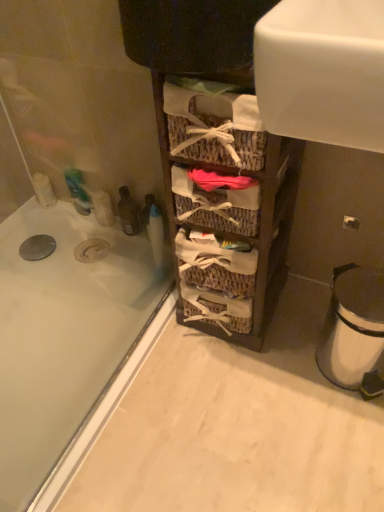
What do you see at coordinates (353, 327) in the screenshot? I see `white metallic trash can at lower right` at bounding box center [353, 327].

Measure the distance between point (359, 369) and camera.

Point (359, 369) is 1.07 meters from camera.

I want to click on white metallic trash can at lower right, so [x=353, y=327].

From the image's perspective, between white glossy bathtub at lower left and white metallic trash can at lower right, which one is located above?

white glossy bathtub at lower left appears higher in the image.

Is white glossy bathtub at lower left wider or thinner than white metallic trash can at lower right?

Considering their sizes, white glossy bathtub at lower left looks broader than white metallic trash can at lower right.

Considering the relative sizes of white glossy bathtub at lower left and white metallic trash can at lower right in the image provided, is white glossy bathtub at lower left shorter than white metallic trash can at lower right?

Yes.

Would you say white glossy bathtub at lower left contains white metallic trash can at lower right?

Definitely not — white metallic trash can at lower right is not inside white glossy bathtub at lower left.

Does white metallic trash can at lower right contain white glossy bathtub at lower left?

No, white metallic trash can at lower right does not contain white glossy bathtub at lower left.

Considering the sizes of objects white metallic trash can at lower right and white glossy bathtub at lower left in the image provided, who is wider, white metallic trash can at lower right or white glossy bathtub at lower left?

Result: With larger width is white glossy bathtub at lower left.

From a real-world perspective, which is physically above, white metallic trash can at lower right or white glossy bathtub at lower left?

From a 3D spatial view, white metallic trash can at lower right is above.

Is white metallic trash can at lower right aimed at white glossy bathtub at lower left?

No.

Considering the sizes of objects woven wood baskets at center and white metallic trash can at lower right in the image provided, who is bigger, woven wood baskets at center or white metallic trash can at lower right?

woven wood baskets at center.

Which object is closer to the camera, woven wood baskets at center or white metallic trash can at lower right?

woven wood baskets at center is more forward.

This screenshot has width=384, height=512. In order to click on trash bin/can below the woven wood baskets at center (from the image's perspective) in this screenshot , I will do [353, 327].

From a real-world perspective, is woven wood baskets at center positioned over white metallic trash can at lower right based on gravity?

Indeed, from a real-world perspective, woven wood baskets at center stands above white metallic trash can at lower right.

Which object is positioned more to the left, white metallic trash can at lower right or woven wood baskets at center?

woven wood baskets at center is more to the left.

Which is in front, white metallic trash can at lower right or woven wood baskets at center?

woven wood baskets at center is in front.

Identify the location of trash bin/can below the woven wood baskets at center (from a real-world perspective). (353, 327).

Could you tell me if white metallic trash can at lower right is facing woven wood baskets at center?

No, white metallic trash can at lower right is not oriented towards woven wood baskets at center.

From the image's perspective, who appears lower, white glossy bathtub at lower left or woven wood baskets at center?

white glossy bathtub at lower left, from the image's perspective.

How different are the orientations of white glossy bathtub at lower left and woven wood baskets at center in degrees?

There is a 89.6-degree angle between the facing directions of white glossy bathtub at lower left and woven wood baskets at center.

Consider the image. Can you confirm if white glossy bathtub at lower left is taller than woven wood baskets at center?

Incorrect, the height of white glossy bathtub at lower left is not larger of that of woven wood baskets at center.

Are white glossy bathtub at lower left and woven wood baskets at center located far from each other?

No, white glossy bathtub at lower left is not far from woven wood baskets at center.

Are woven wood baskets at center and white glossy bathtub at lower left far apart?

Actually, woven wood baskets at center and white glossy bathtub at lower left are a little close together.

Considering the relative positions of woven wood baskets at center and white glossy bathtub at lower left in the image provided, is woven wood baskets at center to the right of white glossy bathtub at lower left from the viewer's perspective?

Yes, woven wood baskets at center is to the right of white glossy bathtub at lower left.

Is woven wood baskets at center wider than white glossy bathtub at lower left?

No, woven wood baskets at center is not wider than white glossy bathtub at lower left.

Is white glossy bathtub at lower left at the back of woven wood baskets at center?

No, woven wood baskets at center is not facing the opposite direction of white glossy bathtub at lower left.

Where is `bathtub that is in front of the white metallic trash can at lower right`? bathtub that is in front of the white metallic trash can at lower right is located at coordinates (63, 335).

This screenshot has width=384, height=512. Identify the location of bathtub that appears above the white metallic trash can at lower right (from the image's perspective). (63, 335).

Estimate the real-world distances between objects in this image. Which object is further from woven wood baskets at center, white metallic trash can at lower right or white glossy bathtub at lower left?

The object further to woven wood baskets at center is white glossy bathtub at lower left.

Estimate the real-world distances between objects in this image. Which object is further from white metallic trash can at lower right, woven wood baskets at center or white glossy bathtub at lower left?

The object further to white metallic trash can at lower right is white glossy bathtub at lower left.

From the image, which object appears to be nearer to white glossy bathtub at lower left, woven wood baskets at center or white metallic trash can at lower right?

woven wood baskets at center.

When comparing their distances from white glossy bathtub at lower left, does white metallic trash can at lower right or woven wood baskets at center seem closer?

woven wood baskets at center is closer to white glossy bathtub at lower left.

Looking at the image, which one is located further to white metallic trash can at lower right, white glossy bathtub at lower left or woven wood baskets at center?

white glossy bathtub at lower left is further to white metallic trash can at lower right.

Looking at the image, which one is located closer to woven wood baskets at center, white glossy bathtub at lower left or white metallic trash can at lower right?

white metallic trash can at lower right lies closer to woven wood baskets at center than the other object.

Find the location of a particular element. cabinetry between white glossy bathtub at lower left and white metallic trash can at lower right is located at coordinates point(227,214).